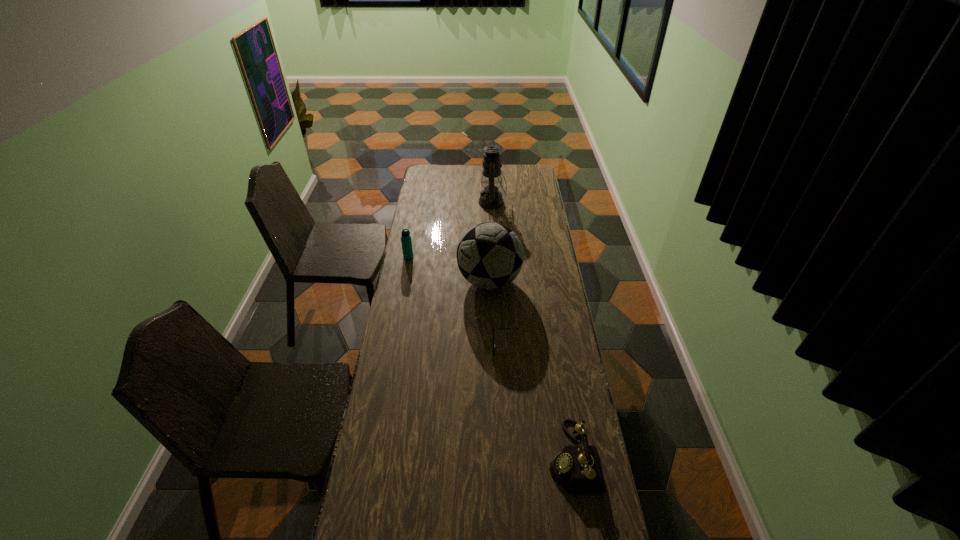
Locate an element on the screen. Image resolution: width=960 pixels, height=540 pixels. object that is at the left edge is located at coordinates (406, 242).

Identify the location of object that is at the right edge. The image size is (960, 540). (576, 468).

You are a GUI agent. You are given a task and a screenshot of the screen. Output one action in this format:
    pyautogui.click(x=<x>, y=<y>)
    Task: Click on the vacant space at the far edge of the desktop
    The width and height of the screenshot is (960, 540).
    Given the screenshot: What is the action you would take?
    pyautogui.click(x=458, y=180)

What are the coordinates of `free region at the left edge of the desktop` in the screenshot? It's located at (403, 298).

The height and width of the screenshot is (540, 960). In the image, there is a desktop. Find the location of `free space at the right edge`. free space at the right edge is located at coordinates (527, 272).

Find the location of a particular element. This screenshot has height=540, width=960. free space at the far left corner of the desktop is located at coordinates (432, 181).

Where is `vacant area that lies between the oil lamp and the rightmost object`? vacant area that lies between the oil lamp and the rightmost object is located at coordinates (533, 329).

This screenshot has width=960, height=540. I want to click on vacant space that's between the second tallest object and the leftmost object, so click(x=449, y=269).

Identify the location of vacant space that is in between the fourth nearest object and the nearest object. Image resolution: width=960 pixels, height=540 pixels. (491, 357).

The width and height of the screenshot is (960, 540). Identify the location of vacant region between the fourth farthest object and the nearest object. (542, 402).